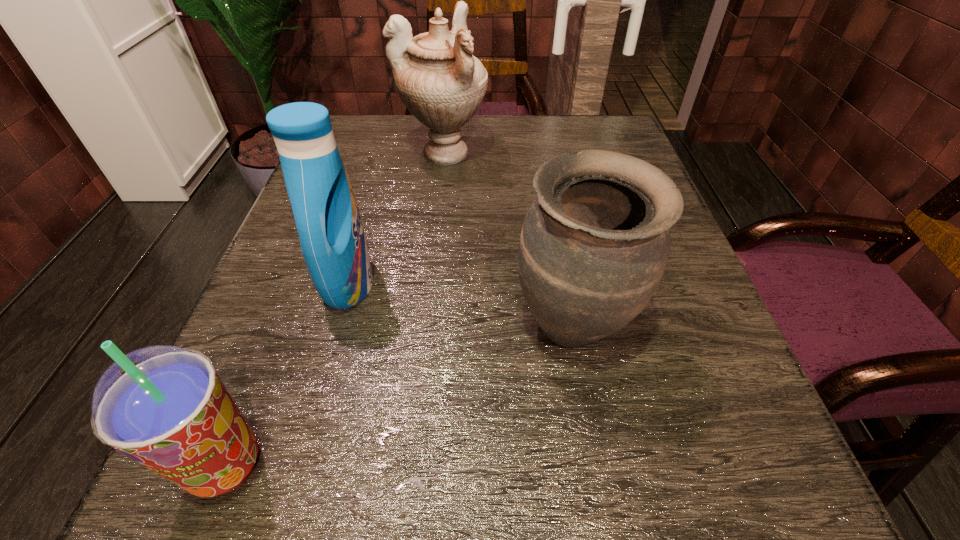
You are a GUI agent. You are given a task and a screenshot of the screen. Output one action in this format:
    pyautogui.click(x=<x>, y=<y>)
    Task: Click on the farther urn
    Image resolution: width=960 pixels, height=540 pixels.
    Given the screenshot: What is the action you would take?
    pos(441,83)

Where is `the left urn`? The width and height of the screenshot is (960, 540). the left urn is located at coordinates (441, 83).

Identify the location of detergent. (333, 243).

I want to click on the right urn, so click(594, 245).

This screenshot has width=960, height=540. I want to click on the nearer urn, so [594, 245].

Find the location of a particular element. smoothie is located at coordinates (165, 407).

Find the location of a particular element. free space located 0.270m on the front of the farther urn is located at coordinates (431, 271).

This screenshot has height=540, width=960. What are the coordinates of `vacant area located 0.220m on the front-facing side of the detergent` in the screenshot? It's located at (511, 284).

This screenshot has width=960, height=540. What are the coordinates of `free space located 0.060m on the back of the rightmost object` in the screenshot? It's located at (560, 258).

I want to click on free spot located 0.150m on the right of the nearest object, so click(401, 465).